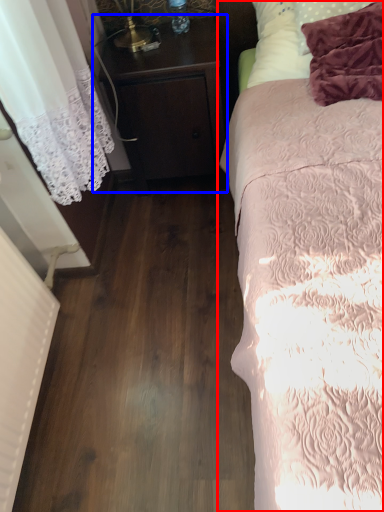
Question: Which of the following is the farthest to the observer, bed (highlighted by a red box) or nightstand (highlighted by a blue box)?

Choices:
 (A) bed
 (B) nightstand

Answer: (B)